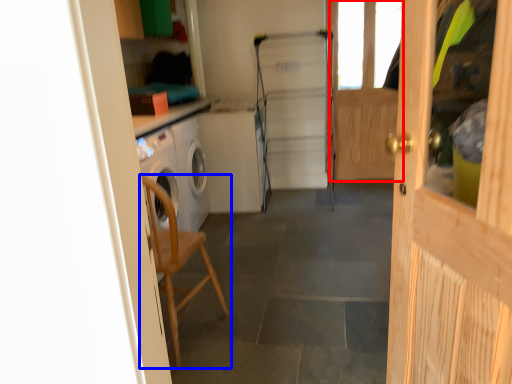
Question: Which object appears closest to the camera in this image, screen door (highlighted by a red box) or chair (highlighted by a blue box)?

Choices:
 (A) screen door
 (B) chair

Answer: (B)